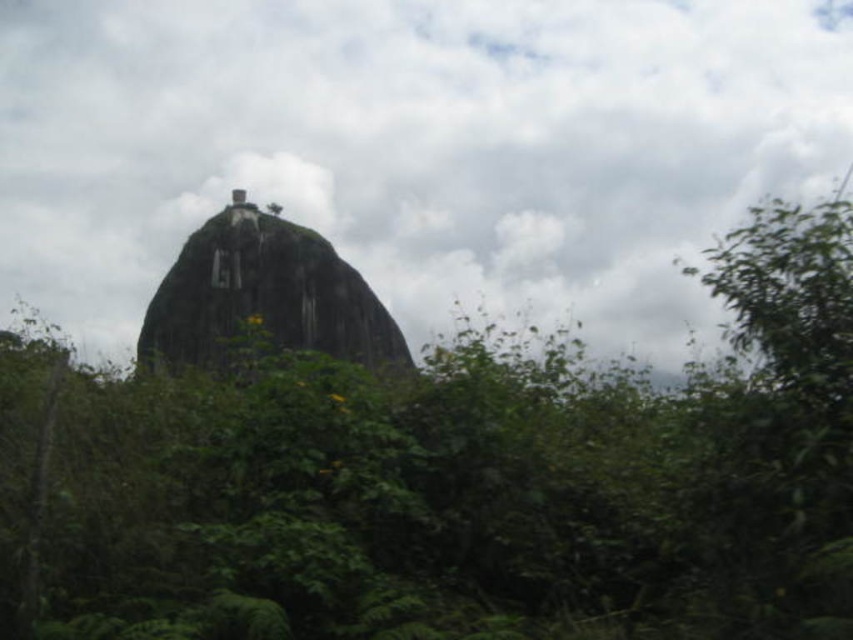
Consider the image. You are a hiker trying to determine the tallest object between the green leafy tree at center and the green rough rock at center. Based on the scene, which one is taller?

The green leafy tree at center is taller than the green rough rock at center.

You are standing in front of the rock formation and want to take a photo. There are two points marked on the rock surface at coordinates point [18,100] and point [276,326]. Which point is closer to your camera when taking the photo?

Point [18,100] is further to the camera than point [276,326], so point [276,326] is closer to the camera.

You are an airplane pilot flying over a tropical region and you see the white fluffy cloud at upper center and the green rough rock at center. Which object is bigger in your view?

The white fluffy cloud at upper center is larger in size than the green rough rock at center, so the white fluffy cloud at upper center is bigger in your view.